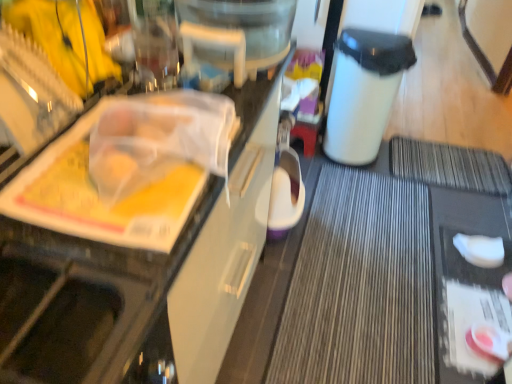
Question: Is pink glossy jar at lower right, which appears as the first food when ordered from the bottom, beside white matte sponge at lower right, the 1th food in the top-to-bottom sequence?

Choices:
 (A) no
 (B) yes

Answer: (A)

Question: Considering the relative sizes of pink glossy jar at lower right, which appears as the first food when ordered from the bottom, and white matte sponge at lower right, the 1th food in the top-to-bottom sequence, in the image provided, is pink glossy jar at lower right, which appears as the first food when ordered from the bottom, wider than white matte sponge at lower right, the 1th food in the top-to-bottom sequence,?

Choices:
 (A) yes
 (B) no

Answer: (A)

Question: Does pink glossy jar at lower right, the second food in the top-to-bottom sequence, come behind white matte sponge at lower right, arranged as the second food when viewed from the front?

Choices:
 (A) no
 (B) yes

Answer: (A)

Question: Is pink glossy jar at lower right, which is the second food from back to front, at the right side of white matte sponge at lower right, the 1th food in the top-to-bottom sequence?

Choices:
 (A) yes
 (B) no

Answer: (B)

Question: Is pink glossy jar at lower right, the second food in the top-to-bottom sequence, facing towards white matte sponge at lower right, arranged as the second food when viewed from the front?

Choices:
 (A) yes
 (B) no

Answer: (B)

Question: Considering the relative sizes of pink glossy jar at lower right, marked as the first food in a front-to-back arrangement, and white matte sponge at lower right, which ranks as the 2th food in bottom-to-top order, in the image provided, is pink glossy jar at lower right, marked as the first food in a front-to-back arrangement, shorter than white matte sponge at lower right, which ranks as the 2th food in bottom-to-top order,?

Choices:
 (A) no
 (B) yes

Answer: (A)

Question: Is white plastic trash bin at center-right outside of white matte sponge at lower right, arranged as the second food when viewed from the front?

Choices:
 (A) no
 (B) yes

Answer: (B)

Question: Does white plastic trash bin at center-right have a greater width compared to white matte sponge at lower right, which appears as the first food when viewed from the back?

Choices:
 (A) yes
 (B) no

Answer: (A)

Question: Is white plastic trash bin at center-right shorter than white matte sponge at lower right, arranged as the second food when viewed from the front?

Choices:
 (A) no
 (B) yes

Answer: (A)

Question: From a real-world perspective, does white plastic trash bin at center-right stand above white matte sponge at lower right, which ranks as the 2th food in bottom-to-top order?

Choices:
 (A) no
 (B) yes

Answer: (B)

Question: Considering the relative sizes of white plastic trash bin at center-right and white matte sponge at lower right, arranged as the second food when viewed from the front, in the image provided, is white plastic trash bin at center-right smaller than white matte sponge at lower right, arranged as the second food when viewed from the front,?

Choices:
 (A) no
 (B) yes

Answer: (A)

Question: Is white matte sponge at lower right, arranged as the second food when viewed from the front, inside white plastic trash bin at center-right?

Choices:
 (A) no
 (B) yes

Answer: (A)

Question: Is white matte sponge at lower right, the 1th food in the top-to-bottom sequence, positioned beyond the bounds of white plastic trash bin at center-right?

Choices:
 (A) yes
 (B) no

Answer: (A)